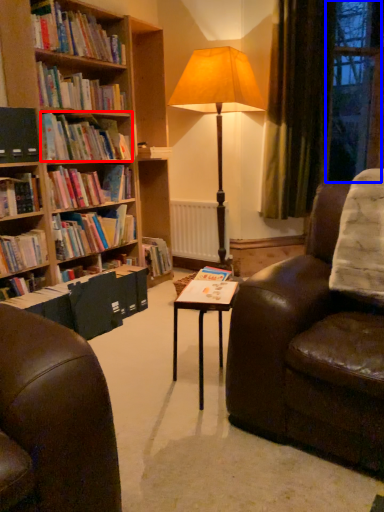
Question: Among these objects, which one is nearest to the camera, book (highlighted by a red box) or window (highlighted by a blue box)?

Choices:
 (A) book
 (B) window

Answer: (A)